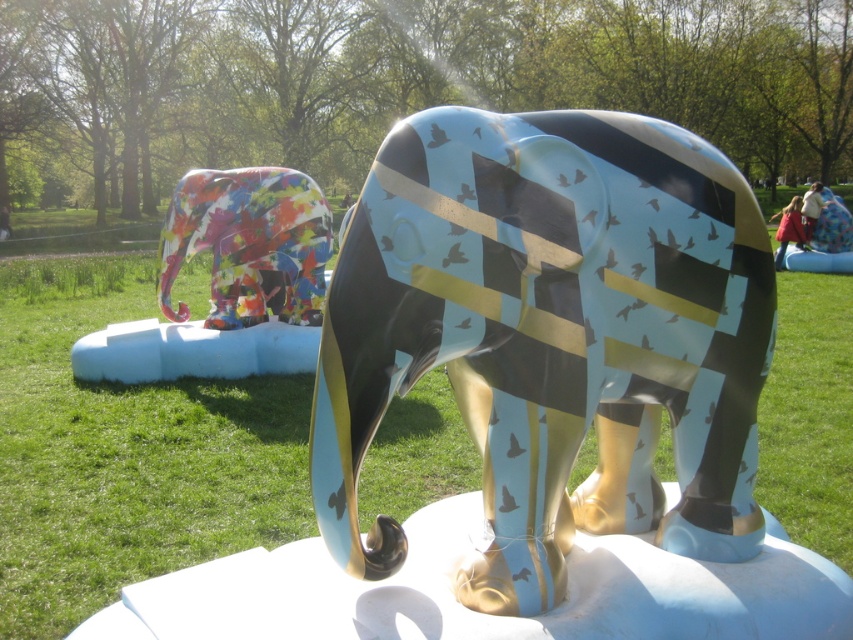
Question: Is shiny metallic elephant at center thinner than multicolored glossy elephant at left?

Choices:
 (A) yes
 (B) no

Answer: (A)

Question: Is shiny metallic elephant at center above green grass at center?

Choices:
 (A) yes
 (B) no

Answer: (B)

Question: Which of the following is the closest to the observer?

Choices:
 (A) (682, 509)
 (B) (306, 212)
 (C) (224, 452)

Answer: (A)

Question: Is the position of shiny metallic elephant at center less distant than that of green grass at center?

Choices:
 (A) no
 (B) yes

Answer: (B)

Question: Among these points, which one is farthest from the camera?

Choices:
 (A) (614, 528)
 (B) (102, 474)

Answer: (B)

Question: Which is nearer to the shiny metallic elephant at center?

Choices:
 (A) multicolored glossy elephant at left
 (B) green grass at center

Answer: (B)